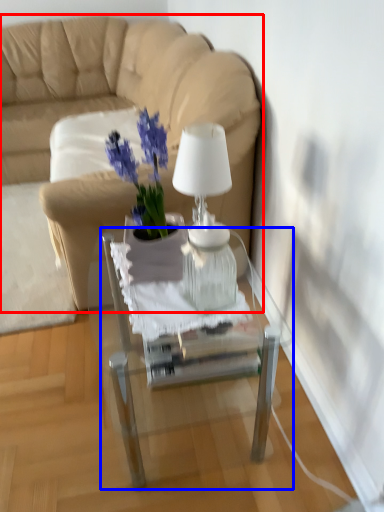
Question: Which object appears closest to the camera in this image, studio couch (highlighted by a red box) or table (highlighted by a blue box)?

Choices:
 (A) studio couch
 (B) table

Answer: (B)